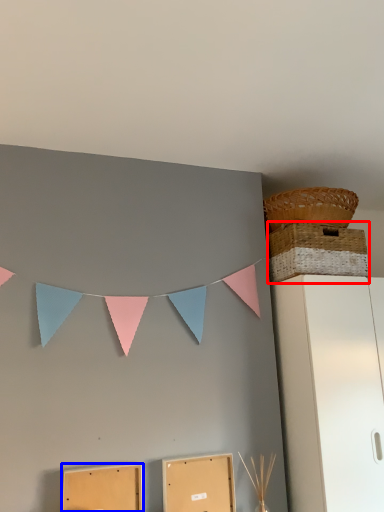
Question: Which point is further to the camera, basket (highlighted by a red box) or cardboard box (highlighted by a blue box)?

Choices:
 (A) basket
 (B) cardboard box

Answer: (A)